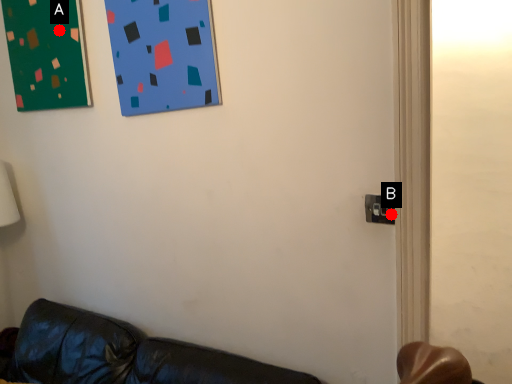
Question: Two points are circled on the image, labeled by A and B beside each circle. Among these points, which one is farthest from the camera?

Choices:
 (A) A is further
 (B) B is further

Answer: (A)